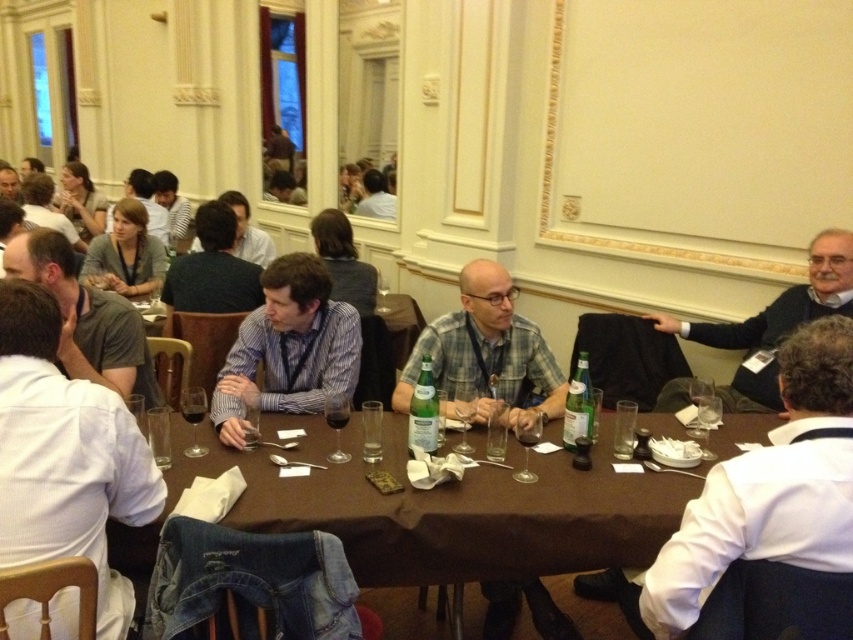
You are a photographer positioned at the back of the room, aiming to capture a group photo of the people seated around the table. You notice the white shirt at left and the plaid fabric shirt at center. Which shirt should you adjust to ensure both are visible in the frame without one blocking the other?

You should adjust the plaid fabric shirt at center, as the white shirt at left is taller and may block the view of the plaid fabric shirt at center if not moved.

You are organizing a seating arrangement for an event and need to ensure that the white shirt at left and the plaid fabric shirt at center are placed appropriately. Based on their sizes, which shirt should be placed in a spot that requires more space?

The plaid fabric shirt at center should be placed in the spot that requires more space because it occupies more space than the white shirt at left.

You are standing at the entrance of the room and want to greet the person wearing the white shirt at left. According to the coordinates provided, in which direction should you move to reach them?

The white shirt at left is located at coordinates point (65, 456), which means it is positioned to the right and slightly forward from your current position at the entrance. Move towards the right side of the room to reach them.